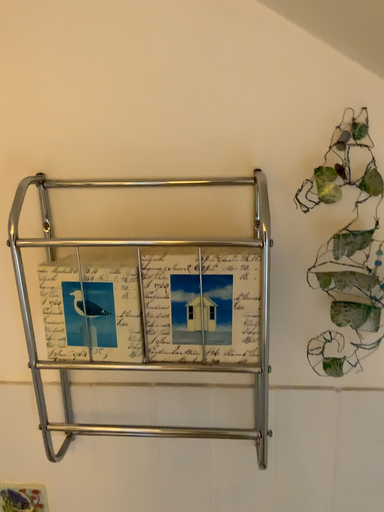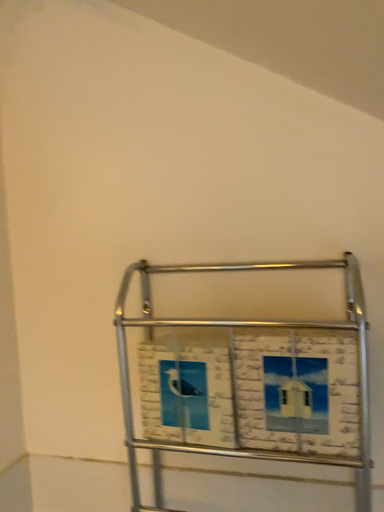
Question: Which way did the camera rotate in the video?

Choices:
 (A) rotated left
 (B) rotated right

Answer: (A)